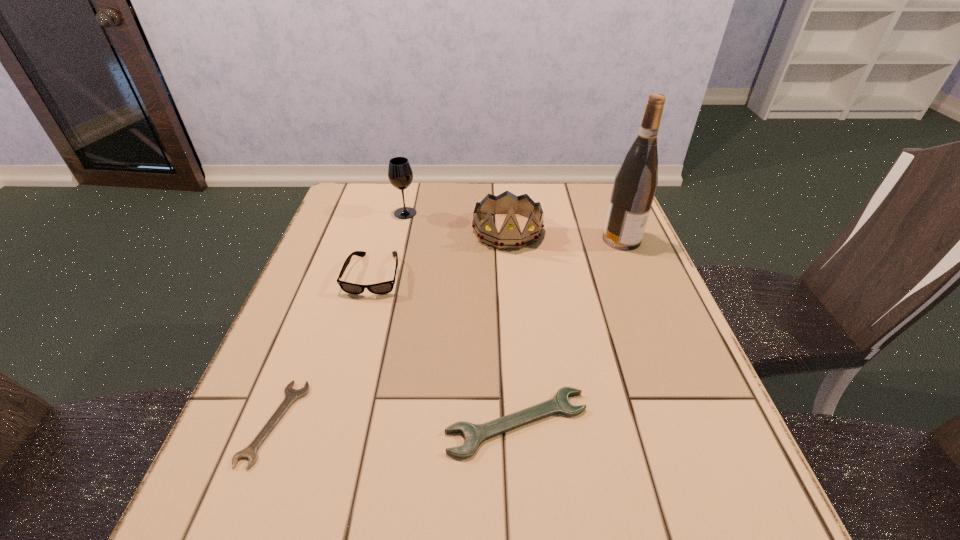
Identify the location of blank space located on the left of the tallest object. (462, 239).

Image resolution: width=960 pixels, height=540 pixels. Identify the location of free space located 0.110m on the front of the wineglass. (398, 243).

I want to click on vacant region located at the front of the tiara with jewels, so click(x=516, y=340).

Find the location of a particular element. This screenshot has width=960, height=540. free space located 0.110m on the front-facing side of the fourth tallest object is located at coordinates (357, 334).

This screenshot has width=960, height=540. What are the coordinates of `vacant space located 0.310m on the back of the taller wrench` in the screenshot? It's located at (507, 279).

The height and width of the screenshot is (540, 960). What are the coordinates of `vacant area located 0.230m on the right of the left wrench` in the screenshot? It's located at (433, 423).

Identify the location of wineglass positioned at the far edge. Image resolution: width=960 pixels, height=540 pixels. (400, 174).

At what (x,y) coordinates should I click in order to perform the action: click on tiara at the far edge. Please return your answer as a coordinate pair (x, y). The image size is (960, 540). Looking at the image, I should click on (x=510, y=236).

Locate an element on the screen. The width and height of the screenshot is (960, 540). sunglasses that is at the left edge is located at coordinates (386, 287).

You are a GUI agent. You are given a task and a screenshot of the screen. Output one action in this format:
    pyautogui.click(x=<x>, y=<y>)
    Task: Click on the wrench that is at the left edge
    Image resolution: width=960 pixels, height=540 pixels.
    Given the screenshot: What is the action you would take?
    pyautogui.click(x=291, y=395)